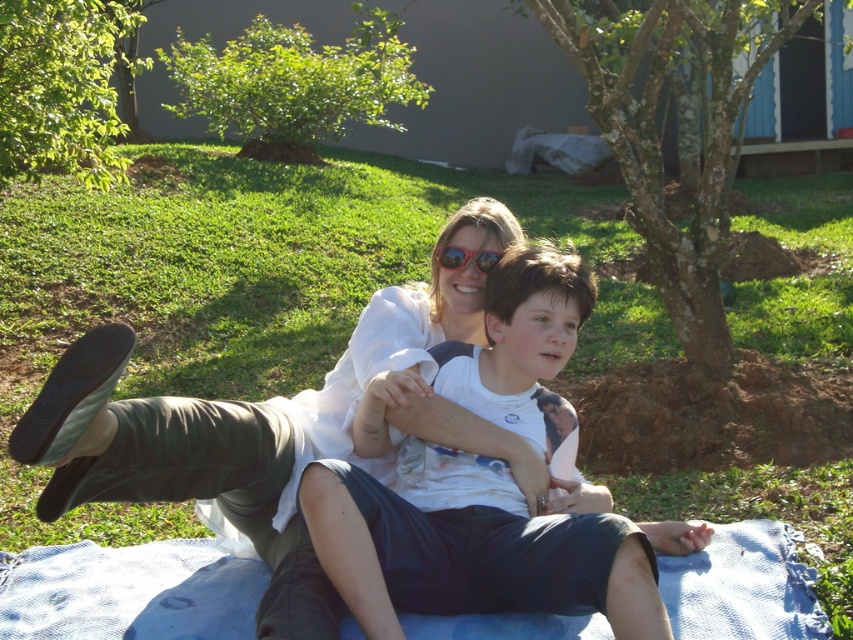
You are standing at the center of the image and want to pick up the white cotton shirt at center. In which direction should you move to reach it?

Since the white cotton shirt at center is located at point coordinates of 0.856 on the x axis and 0.553 on the y axis, you should move to the right and slightly forward to reach it.

You are planning to lay out a picnic setup and have both the white cotton shirt at center and the blue woven blanket at lower center. Which item should you use as a picnic blanket and why?

The blue woven blanket at lower center should be used as the picnic blanket because it is smaller than the white cotton shirt at center, making it more appropriate for covering a designated area.

You are standing in the outdoor area and want to place a small picnic basket on the blue woven blanket at lower center. If your arm can reach up to 2 meters, can you place the basket without moving closer?

The blue woven blanket at lower center is 2.31 meters away from the viewer. Since your arm can only reach up to 2 meters, you cannot place the basket without moving closer.